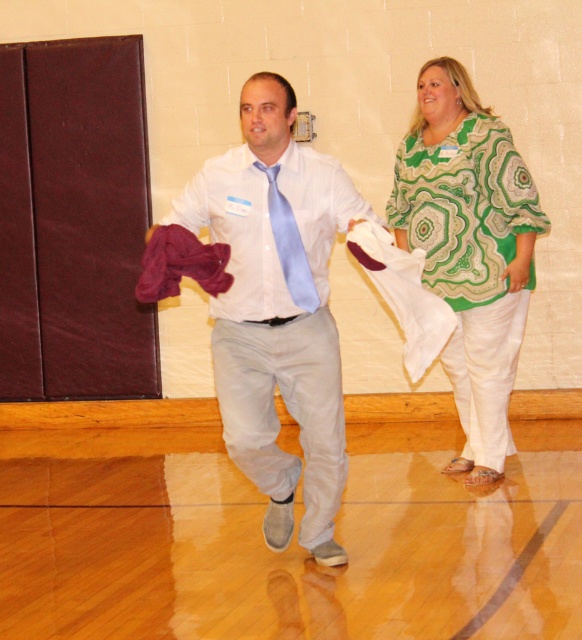
Question: Does light gray cotton shirt at center appear under maroon fabric at center?

Choices:
 (A) yes
 (B) no

Answer: (A)

Question: Estimate the real-world distances between objects in this image. Which object is farther from the white satin shirt at center?

Choices:
 (A) white cotton cloth at center
 (B) green paisley blouse at right

Answer: (B)

Question: Estimate the real-world distances between objects in this image. Which object is farther from the maroon fabric at center?

Choices:
 (A) white cotton cloth at center
 (B) light gray cotton shirt at center
 (C) green paisley blouse at right
 (D) white satin shirt at center

Answer: (C)

Question: Is green paisley blouse at right below maroon fabric at center?

Choices:
 (A) no
 (B) yes

Answer: (A)

Question: Which point is closer to the camera?

Choices:
 (A) maroon fabric at center
 (B) white cotton cloth at center
 (C) light blue silk tie at center
 (D) white satin shirt at center

Answer: (B)

Question: Can you confirm if maroon fabric at center is positioned to the left of light blue silk tie at center?

Choices:
 (A) no
 (B) yes

Answer: (B)